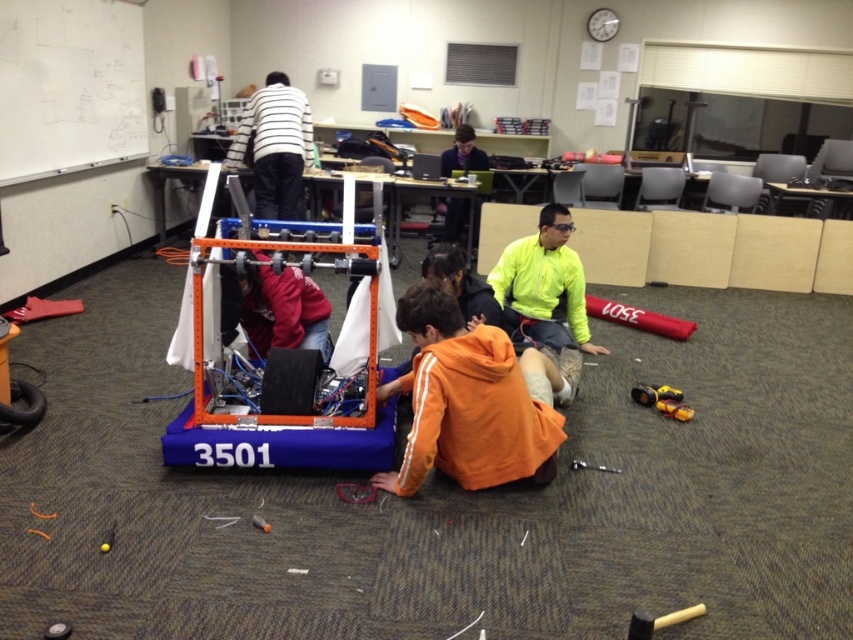
Question: Is orange fleece jacket at lower center closer to the viewer compared to dark blue shirt at center?

Choices:
 (A) yes
 (B) no

Answer: (A)

Question: Which of the following is the closest to the observer?

Choices:
 (A) (444, 240)
 (B) (303, 288)
 (C) (305, 362)

Answer: (C)

Question: Is orange fleece jacket at lower center thinner than black rubber tire at center?

Choices:
 (A) yes
 (B) no

Answer: (B)

Question: Among these points, which one is farthest from the camera?

Choices:
 (A) (473, 227)
 (B) (279, 136)

Answer: (A)

Question: Which is nearer to the striped fabric shirt at upper center?

Choices:
 (A) neon yellow jacket at center
 (B) matte red jacket at center

Answer: (B)

Question: Can you confirm if matte red jacket at center is bigger than black rubber tire at center?

Choices:
 (A) no
 (B) yes

Answer: (B)